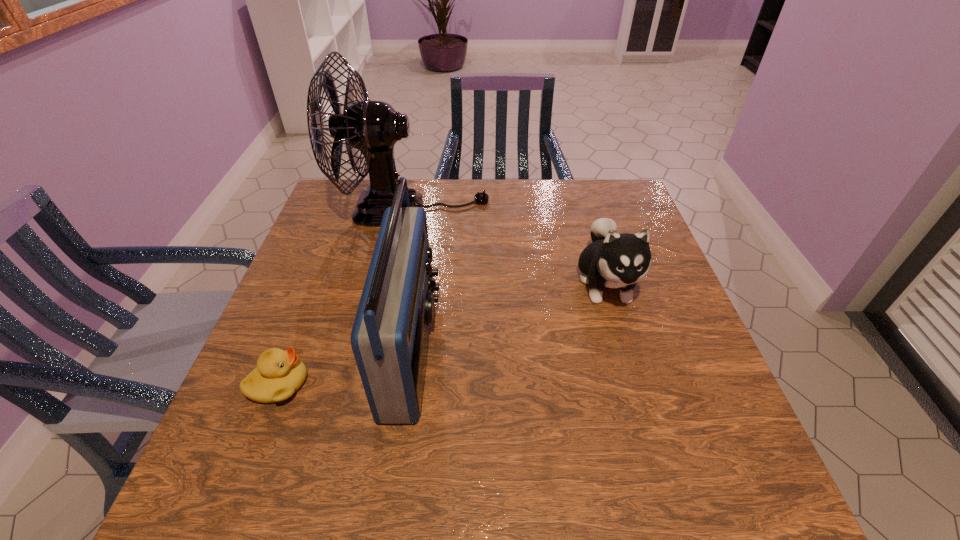
You are a GUI agent. You are given a task and a screenshot of the screen. Output one action in this format:
    pyautogui.click(x=<x>, y=<y>)
    Task: Click on the free space between the radio receiver and the second shortest object
    The width and height of the screenshot is (960, 540).
    Given the screenshot: What is the action you would take?
    pyautogui.click(x=509, y=316)

Find the location of a particular element. This screenshot has height=540, width=960. free space between the fan and the rightmost object is located at coordinates (509, 247).

Identify the location of free spot between the fan and the shortest object. This screenshot has height=540, width=960. (346, 297).

At what (x,y) coordinates should I click in order to perform the action: click on vacant space that is in between the rightmost object and the fan. Please return your answer as a coordinate pair (x, y). Looking at the image, I should click on (509, 247).

At what (x,y) coordinates should I click in order to perform the action: click on unoccupied position between the duckling and the farthest object. Please return your answer as a coordinate pair (x, y). Looking at the image, I should click on (346, 297).

Find the location of a particular element. The image size is (960, 540). vacant space that is in between the duckling and the radio receiver is located at coordinates (346, 367).

Find the location of `blank region between the rightmost object and the third shortest object`. blank region between the rightmost object and the third shortest object is located at coordinates (509, 316).

Locate an element on the screen. Image resolution: width=960 pixels, height=540 pixels. unoccupied area between the rightmost object and the radio receiver is located at coordinates click(509, 316).

Point out which object is positioned as the second nearest to the second shortest object. Please provide its 2D coordinates. Your answer should be formatted as a tuple, i.e. [(x, y)], where the tuple contains the x and y coordinates of a point satisfying the conditions above.

[(389, 338)]

Choose which object is the third nearest neighbor to the duckling. Please provide its 2D coordinates. Your answer should be formatted as a tuple, i.e. [(x, y)], where the tuple contains the x and y coordinates of a point satisfying the conditions above.

[(613, 260)]